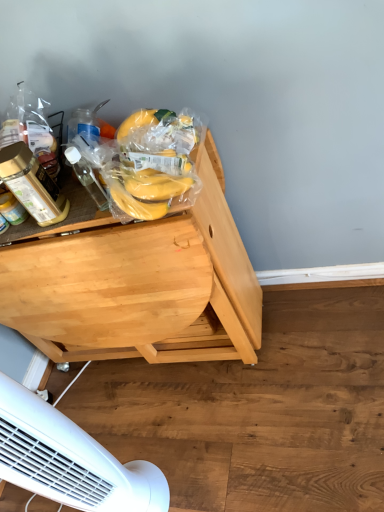
You are a GUI agent. You are given a task and a screenshot of the screen. Output one action in this format:
    pyautogui.click(x=<x>, y=<y>)
    Task: Click on the free space between white plastic mechanical fan at lower left and light wood desk at center
    
    Given the screenshot: What is the action you would take?
    pyautogui.click(x=157, y=416)